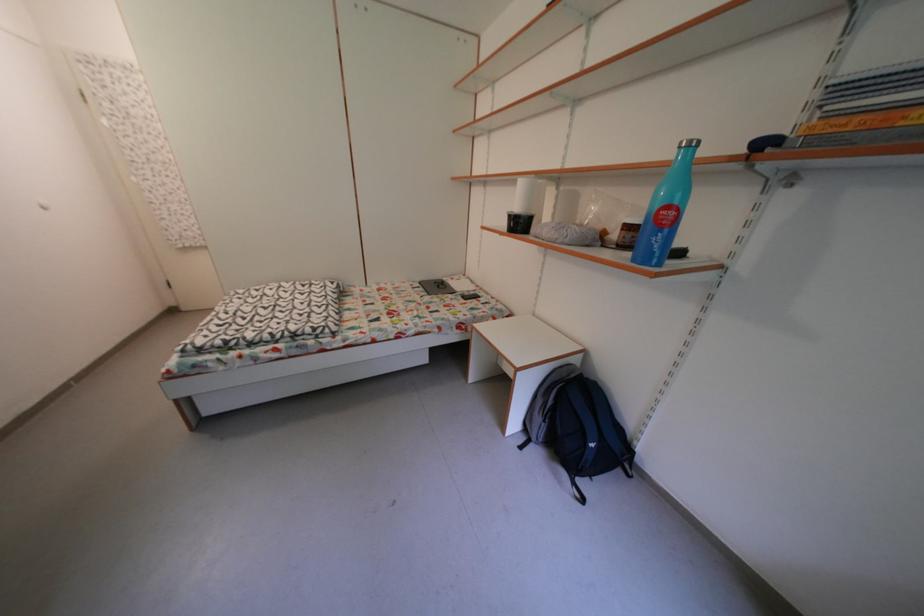
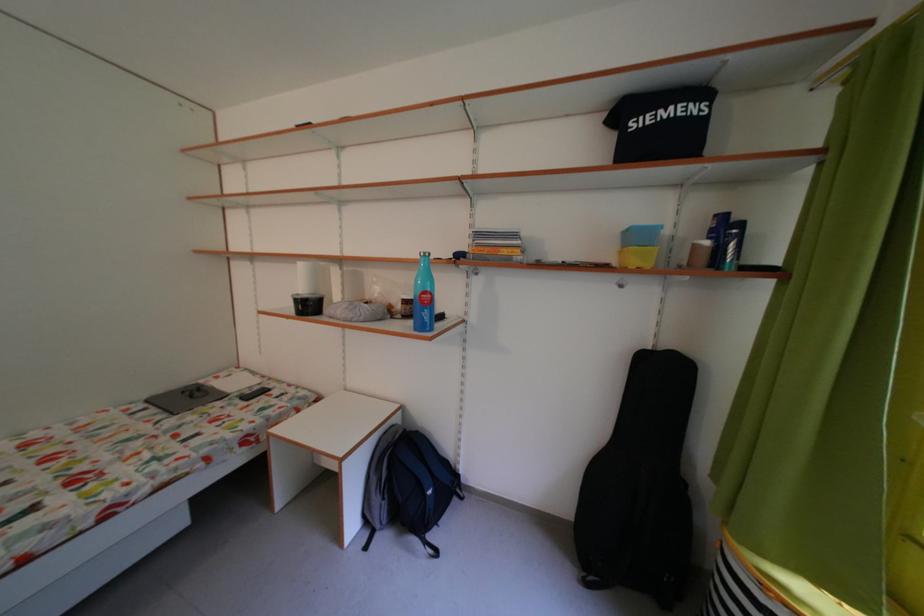
Where in the second image is the point corresponding to pixel 631 252 from the first image?

(416, 322)